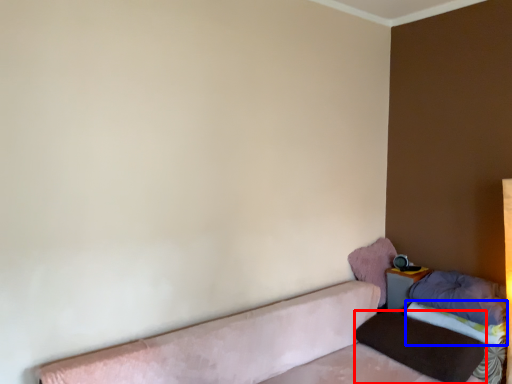
Question: Which point is closer to the camera, pillow (highlighted by a red box) or sheet (highlighted by a blue box)?

Choices:
 (A) pillow
 (B) sheet

Answer: (A)